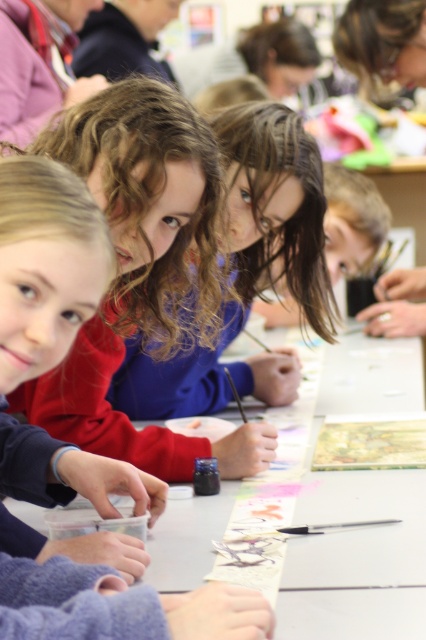
In the classroom scene, there are two children wearing a matte red sweater at center and a blue fabric shirt at center. Which child is sitting to the left of the other?

The matte red sweater at center is positioned on the left side of blue fabric shirt at center, so the child wearing the matte red sweater at center is sitting to the left of the child wearing the blue fabric shirt at center.

You are a teacher observing the classroom. You need to locate the matte red sweater at center quickly. Based on the coordinates provided, where would you look first?

The matte red sweater at center is located at point (141,273), so you should look towards the center of the image slightly to the right and down from the top.